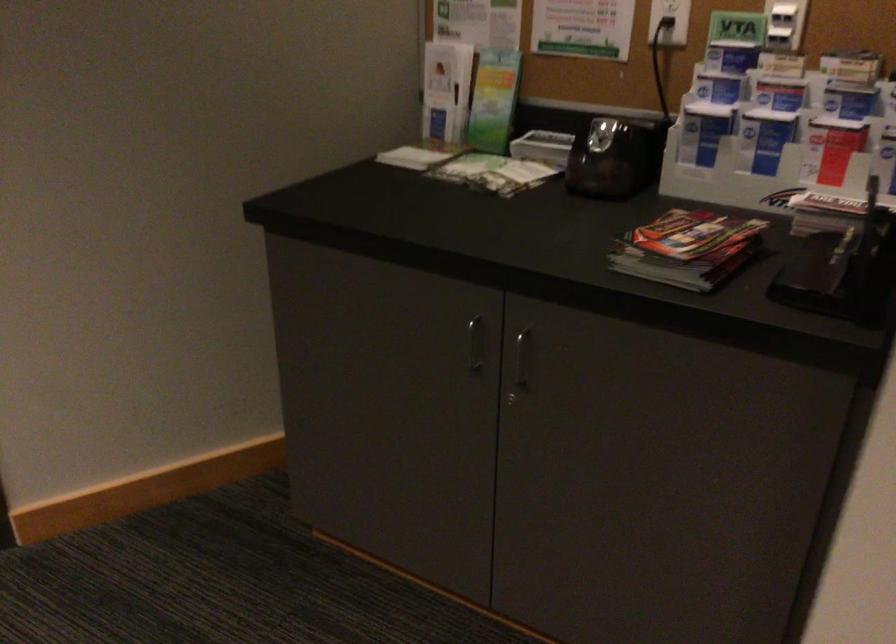
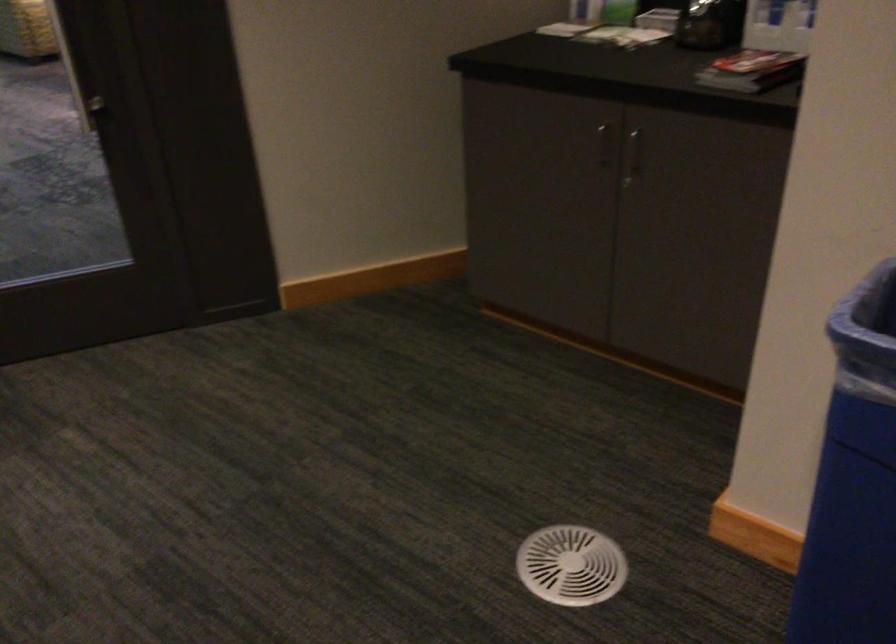
The point at (478,345) is marked in the first image. Where is the corresponding point in the second image?

(604, 144)